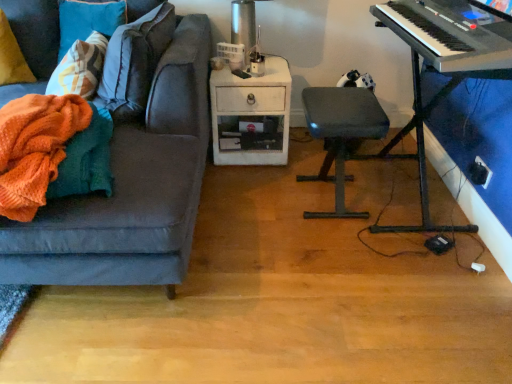
Identify the location of vacant region to the left of black plastic keyboard at right. (279, 208).